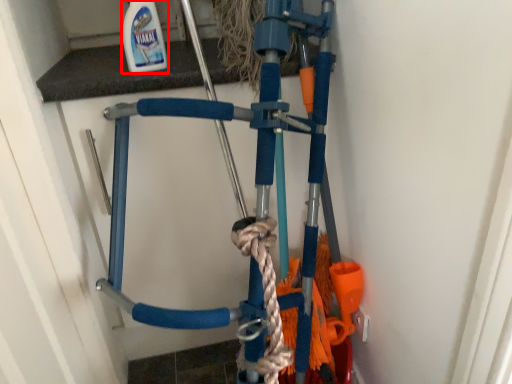
Question: From the image, what is the correct spatial relationship of cleaning product (annotated by the red box) in relation to bicycle?

Choices:
 (A) right
 (B) left

Answer: (B)